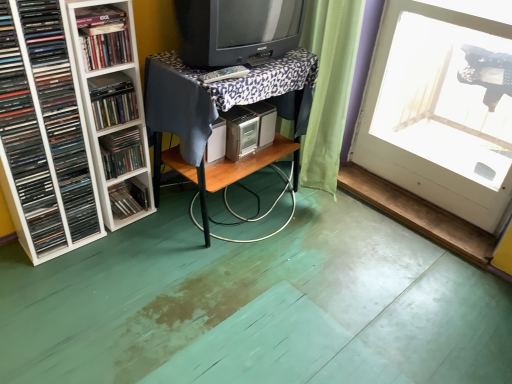
Question: Looking at their shapes, would you say matte black book at upper left, which ranks as the 5th book in bottom-to-top order, is wider or thinner than matte plastic books at left, the second book positioned from the bottom?

Choices:
 (A) wide
 (B) thin

Answer: (A)

Question: From a real-world perspective, is matte black book at upper left, which is counted as the 1th book, starting from the top, positioned above or below matte plastic books at left, which is the fourth book in top-to-bottom order?

Choices:
 (A) below
 (B) above

Answer: (B)

Question: Which object is positioned farthest from the matte black cd at left, positioned as the 2th book in top-to-bottom order?

Choices:
 (A) matte plastic books at left, the second book positioned from the bottom
 (B) matte black television at center
 (C) white glossy door at upper right
 (D) wooden table at center, which is the second table from bottom to top
 (E) wooden table at center, marked as the first table in a bottom-to-top arrangement

Answer: (C)

Question: Estimate the real-world distances between objects in this image. Which object is closer to the matte black cd case at lower left, the 5th book from the top?

Choices:
 (A) white plastic shelf at left, which appears as the 3th book when viewed from the top
 (B) white glossy door at upper right
 (C) matte black cd at left, which is the fourth book in bottom-to-top order
 (D) wooden table at center, marked as the first table in a bottom-to-top arrangement
 (E) wooden table at center, which is the second table from bottom to top

Answer: (D)